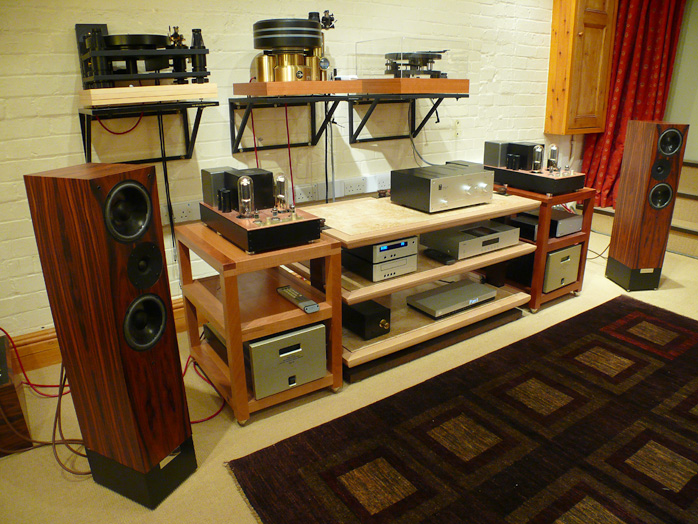
At what (x,y) coordinates should I click in order to perform the action: click on left speaker. Please return your answer as a coordinate pair (x, y). Looking at the image, I should click on (163, 447).